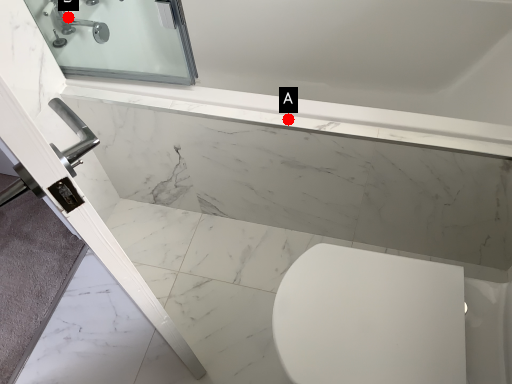
Question: Two points are circled on the image, labeled by A and B beside each circle. Among these points, which one is farthest from the camera?

Choices:
 (A) A is further
 (B) B is further

Answer: (B)